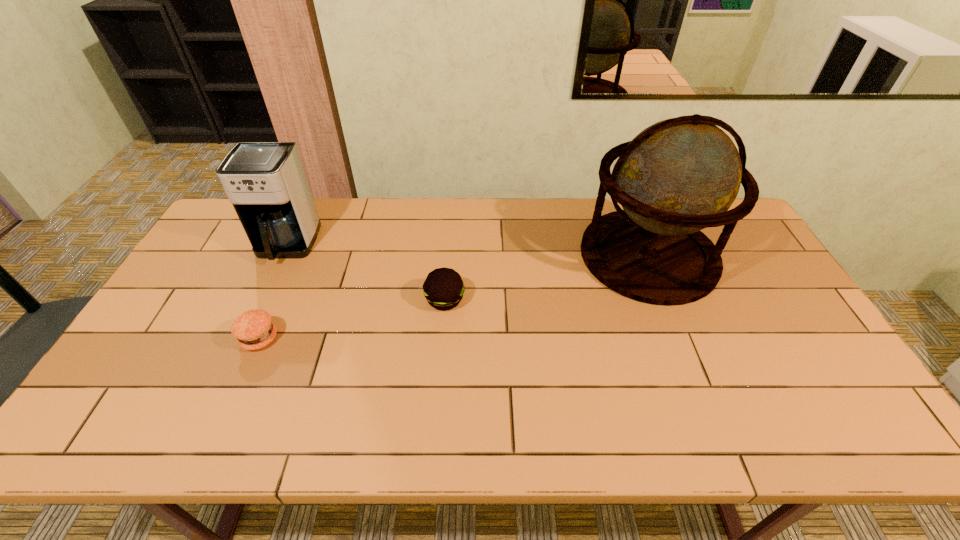
The image size is (960, 540). In order to click on free region located on the front panel of the third shortest object in this screenshot , I will do `click(254, 313)`.

You are a GUI agent. You are given a task and a screenshot of the screen. Output one action in this format:
    pyautogui.click(x=<x>, y=<y>)
    Task: Click on the vacant region located 0.370m on the right of the taller patty
    This screenshot has height=540, width=960.
    Given the screenshot: What is the action you would take?
    pyautogui.click(x=594, y=300)

This screenshot has width=960, height=540. What are the coordinates of `vacant space located on the left of the shortest object` in the screenshot? It's located at (143, 339).

The image size is (960, 540). What are the coordinates of `globe that is at the far edge` in the screenshot? It's located at [678, 176].

Locate an element on the screen. coffee maker present at the far edge is located at coordinates (266, 182).

At what (x,y) coordinates should I click in order to perform the action: click on object that is at the right edge. Please return your answer as a coordinate pair (x, y). Looking at the image, I should click on (678, 176).

The height and width of the screenshot is (540, 960). Identify the location of object that is at the far right corner. (678, 176).

Find the location of a particular element. vacant space at the far edge of the desktop is located at coordinates (330, 234).

In the image, there is a desktop. Identify the location of free space at the near edge. (397, 431).

This screenshot has height=540, width=960. What are the coordinates of `vacant space at the left edge of the desktop` in the screenshot? It's located at (239, 265).